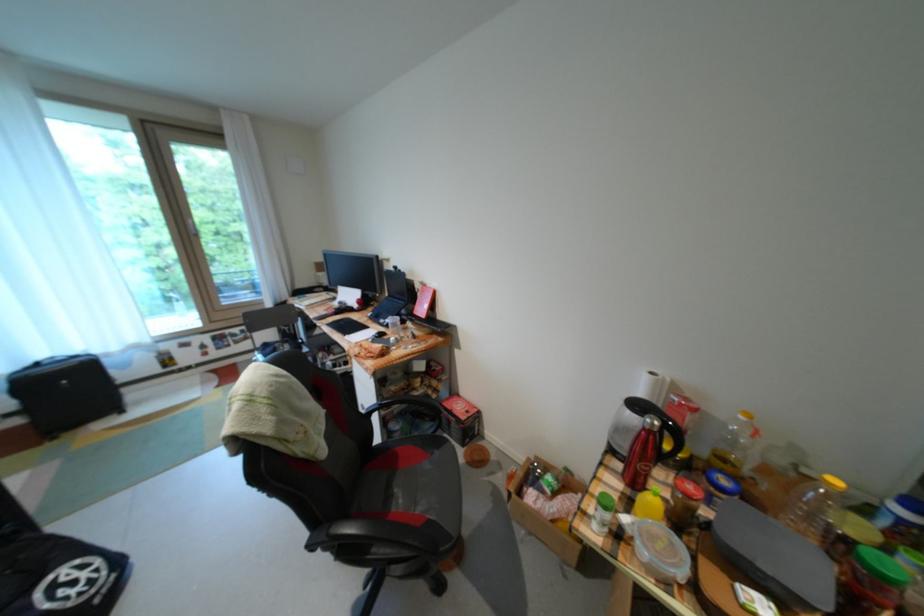
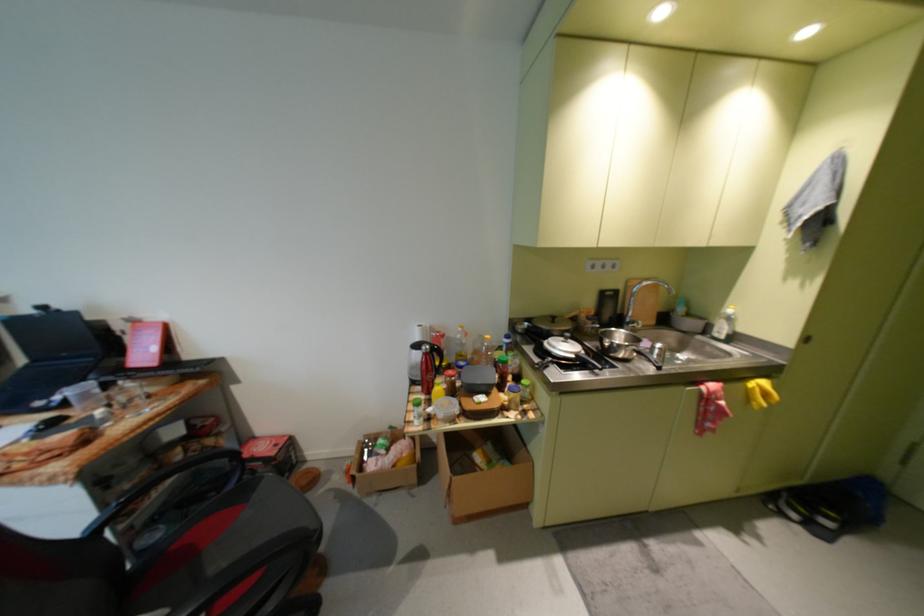
Find the pixel in the second image that matches (763,480) in the first image.

(482, 359)